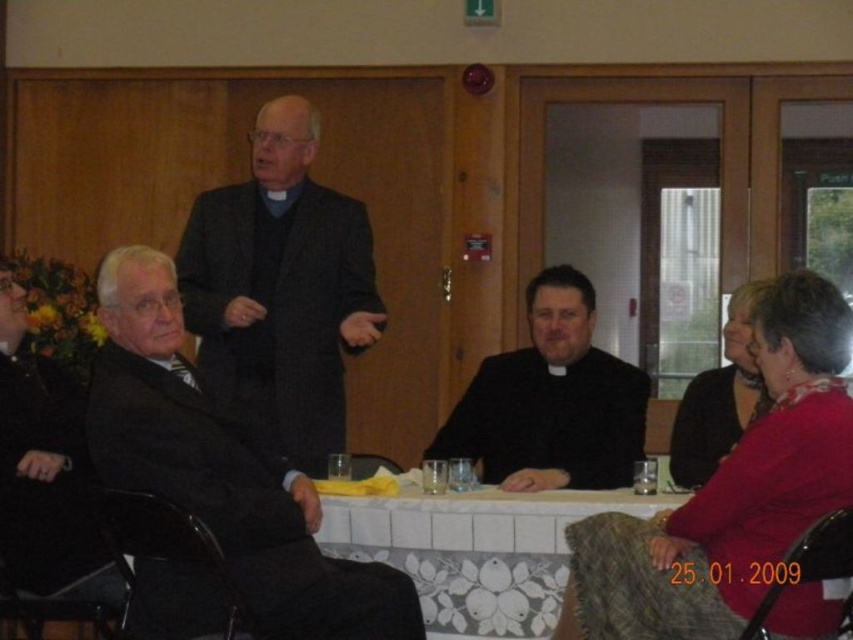
Is dark textured suit at center taller than white floral tablecloth at center?

Indeed, dark textured suit at center has a greater height compared to white floral tablecloth at center.

Does point (207, 228) come in front of point (563, 564)?

That is False.

Find the location of `dark textured suit at center`. dark textured suit at center is located at coordinates (281, 289).

Looking at this image, can you confirm if dark textured suit at center is thinner than black matte suit at center?

Correct, dark textured suit at center's width is less than black matte suit at center's.

Who is lower down, dark textured suit at center or black matte suit at center?

Positioned lower is black matte suit at center.

Image resolution: width=853 pixels, height=640 pixels. In order to click on dark textured suit at center in this screenshot , I will do `click(281, 289)`.

This screenshot has height=640, width=853. I want to click on dark textured suit at center, so click(x=281, y=289).

Between matte black suit at left and white floral tablecloth at center, which one is positioned higher?

matte black suit at left is higher up.

Is point (285, 532) positioned after point (496, 490)?

No, (285, 532) is closer to viewer.

Where is `matte black suit at left`? matte black suit at left is located at coordinates (222, 470).